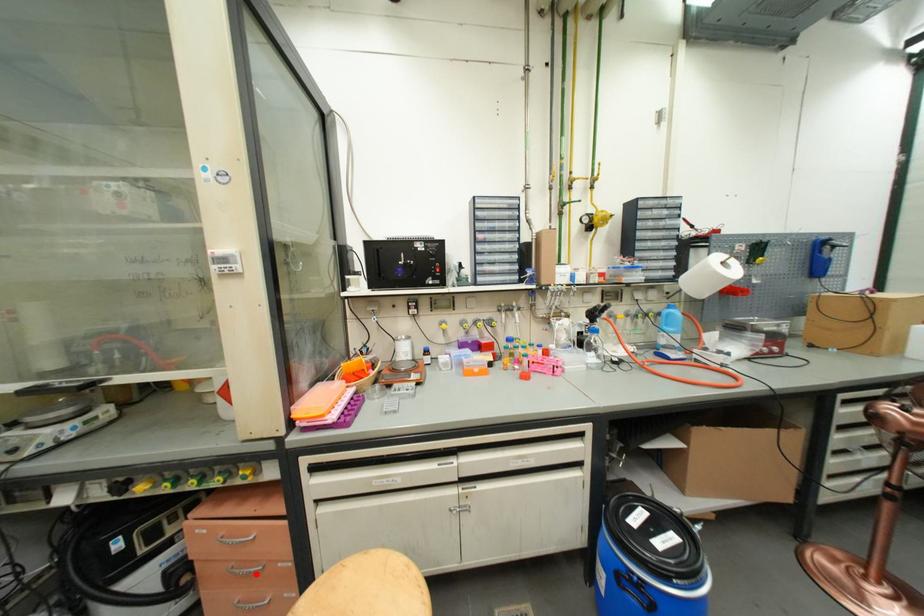
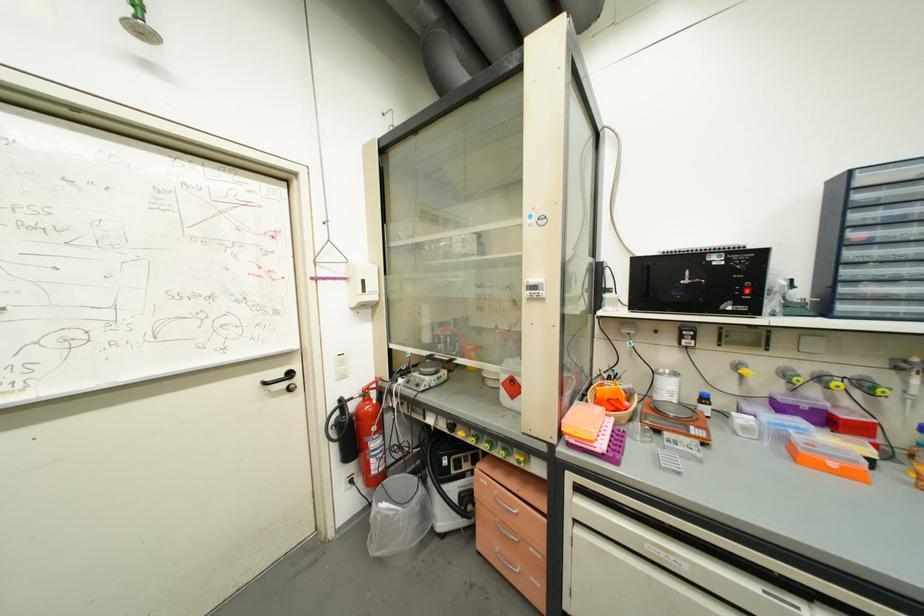
Question: I am providing you with two images of the same scene from different viewpoints. Given a red point in image1, look at the same physical point in image2. Is it:

Choices:
 (A) Closer to the viewpoint
 (B) Farther from the viewpoint

Answer: (B)